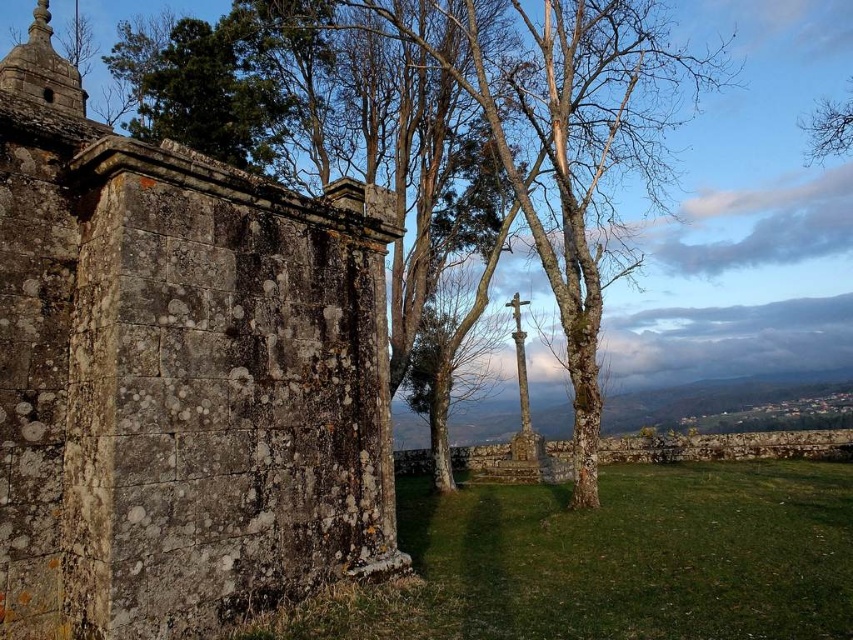
Between rusty stone wall at left and bare wood tree at upper right, which one has less height?

Standing shorter between the two is rusty stone wall at left.

At what (x,y) coordinates should I click in order to perform the action: click on rusty stone wall at left. Please return your answer as a coordinate pair (x, y). Looking at the image, I should click on click(177, 376).

Is point (165, 300) positioned before point (846, 148)?

That is True.

Locate an element on the screen. This screenshot has height=640, width=853. rusty stone wall at left is located at coordinates (177, 376).